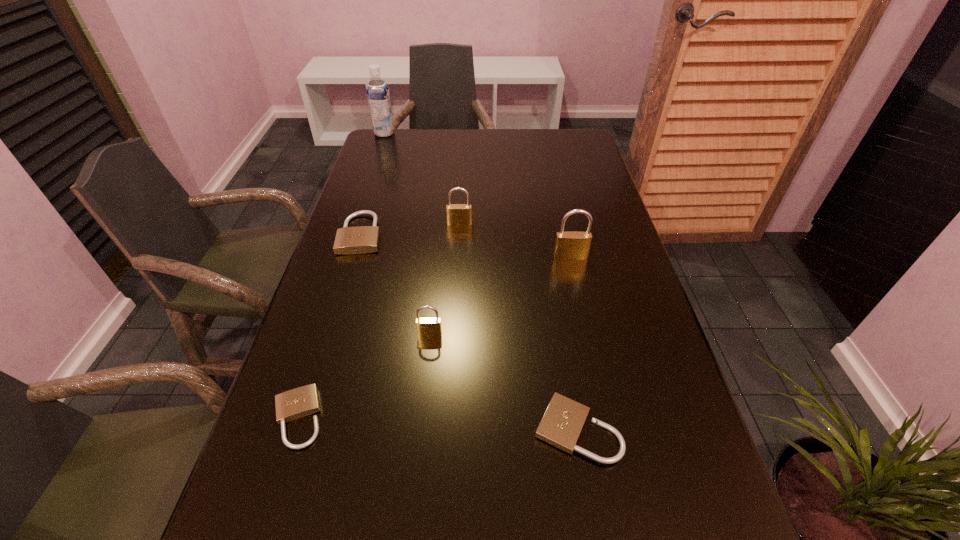
This screenshot has height=540, width=960. I want to click on the second biggest beige padlock, so click(561, 425).

Identify the location of the sixth tallest object. (561, 425).

Identify the location of the shortest padlock. The width and height of the screenshot is (960, 540). (303, 401).

Locate an element on the screen. the smallest beige padlock is located at coordinates (303, 401).

Where is `vacant area situated 0.050m on the label of the farthest object`? The width and height of the screenshot is (960, 540). vacant area situated 0.050m on the label of the farthest object is located at coordinates (407, 133).

The image size is (960, 540). Find the location of `vacant space located on the front-facing side of the second tallest object`. vacant space located on the front-facing side of the second tallest object is located at coordinates (574, 274).

Identify the location of vacant space situated on the front-facing side of the farthest brass padlock. (459, 241).

I want to click on vacant space located on the front-facing side of the fifth farthest object, so click(425, 380).

Where is `vacant space positioned on the front of the third shortest object`? Image resolution: width=960 pixels, height=540 pixels. vacant space positioned on the front of the third shortest object is located at coordinates (315, 385).

You are a GUI agent. You are given a task and a screenshot of the screen. Output one action in this format:
    pyautogui.click(x=<x>, y=<y>)
    Task: Click on the blank area located 0.250m on the left of the second shortest padlock
    This screenshot has width=960, height=540.
    Given the screenshot: What is the action you would take?
    pyautogui.click(x=397, y=430)